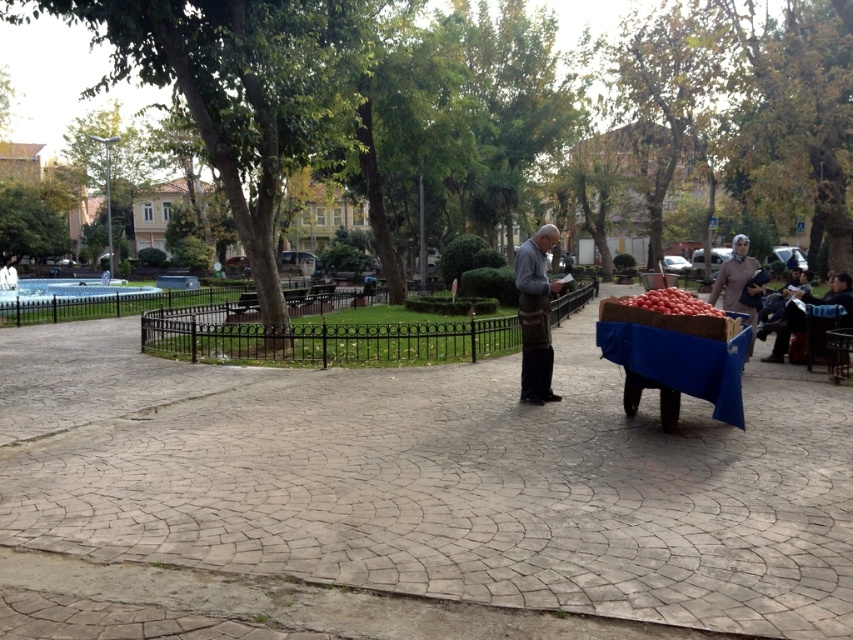
Question: Can you confirm if brown woolen coat at center is positioned below red matte tomatoes at right?

Choices:
 (A) no
 (B) yes

Answer: (B)

Question: Which object appears farthest from the camera in this image?

Choices:
 (A) blue fabric cart at right
 (B) brown woolen coat at center
 (C) red matte tomatoes at right

Answer: (B)

Question: Among these objects, which one is farthest from the camera?

Choices:
 (A) brown woolen coat at center
 (B) red matte tomatoes at right

Answer: (A)

Question: Is brown woolen coat at center above red matte tomatoes at right?

Choices:
 (A) yes
 (B) no

Answer: (B)

Question: Which point is closer to the camera?

Choices:
 (A) blue fabric cart at right
 (B) brown woolen coat at center

Answer: (A)

Question: Can you confirm if blue fabric cart at right is bigger than red matte tomatoes at right?

Choices:
 (A) yes
 (B) no

Answer: (B)